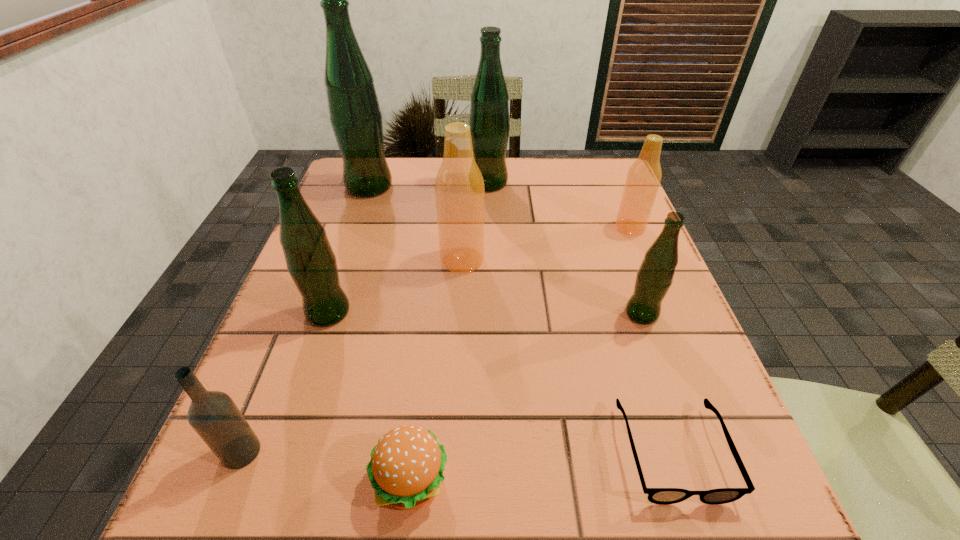
Find the location of a particular element. The width and height of the screenshot is (960, 540). vodka is located at coordinates (214, 416).

You are a GUI agent. You are given a task and a screenshot of the screen. Output one action in this format:
    pyautogui.click(x=<x>, y=<y>)
    Task: Click on the black vodka
    
    Given the screenshot: What is the action you would take?
    pyautogui.click(x=214, y=416)

Image resolution: width=960 pixels, height=540 pixels. In order to click on hamburger in this screenshot , I will do `click(406, 468)`.

At what (x,y) coordinates should I click in order to perform the action: click on spectacles. Please return your answer as a coordinate pair (x, y). Looking at the image, I should click on (663, 496).

This screenshot has height=540, width=960. In order to click on the shortest object in this screenshot , I will do `click(663, 496)`.

Identify the location of free location located on the right of the tallest object. click(x=420, y=186).

The height and width of the screenshot is (540, 960). In order to click on free space located 0.310m on the right of the third smallest green beer bottle in this screenshot , I will do `click(623, 183)`.

Locate an element on the screen. vacant space located on the back of the sixth nearest object is located at coordinates (467, 163).

Find the location of `vacant space located on the back of the third biggest green beer bottle`. vacant space located on the back of the third biggest green beer bottle is located at coordinates (356, 230).

Where is `free space located 0.270m on the front of the rightmost green beer bottle`? The width and height of the screenshot is (960, 540). free space located 0.270m on the front of the rightmost green beer bottle is located at coordinates (699, 472).